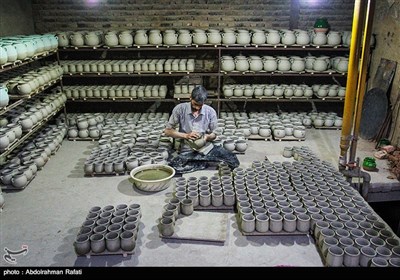
Identify the location of green clay pot. This screenshot has width=400, height=280. (371, 161).